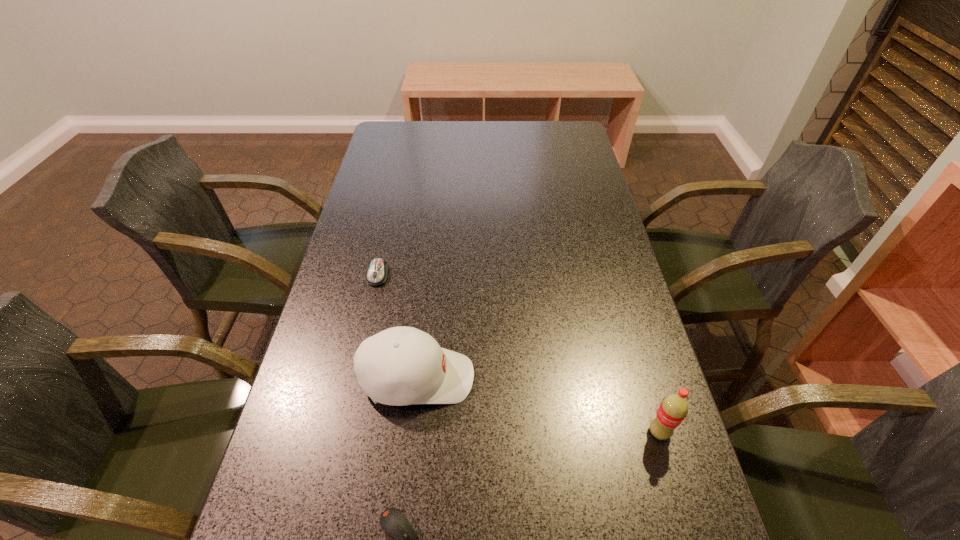
Locate an element on the screen. computer mouse that is at the left edge is located at coordinates (377, 273).

Where is `object that is positioned at the right edge`? The width and height of the screenshot is (960, 540). object that is positioned at the right edge is located at coordinates (673, 409).

Locate an element on the screen. The image size is (960, 540). free space at the far edge is located at coordinates (450, 127).

Locate an element on the screen. vacant space at the left edge is located at coordinates (377, 197).

Image resolution: width=960 pixels, height=540 pixels. What are the coordinates of `vacant space at the right edge of the desktop` in the screenshot? It's located at (571, 171).

The height and width of the screenshot is (540, 960). What are the coordinates of `free space at the far left corner of the desktop` in the screenshot? It's located at (420, 139).

Locate an element on the screen. vacant space at the far right corner of the desktop is located at coordinates (564, 128).

Image resolution: width=960 pixels, height=540 pixels. I want to click on free space between the rightmost object and the second shortest object, so click(518, 353).

The width and height of the screenshot is (960, 540). I want to click on vacant region between the rightmost object and the baseball cap, so (x=538, y=405).

Locate an element on the screen. unoccupied position between the farthest object and the soda is located at coordinates (518, 353).